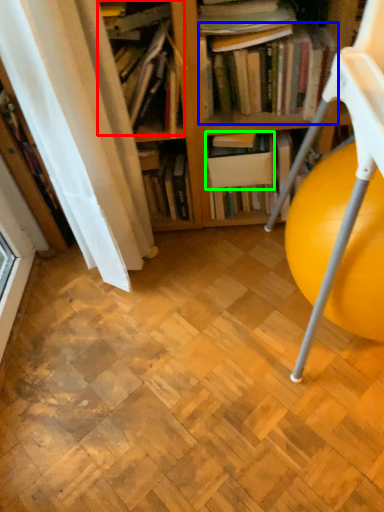
Question: Which object is positioned farthest from book (highlighted by a red box)? Select from book (highlighted by a blue box) and paperback book (highlighted by a green box).

Choices:
 (A) book
 (B) paperback book

Answer: (B)